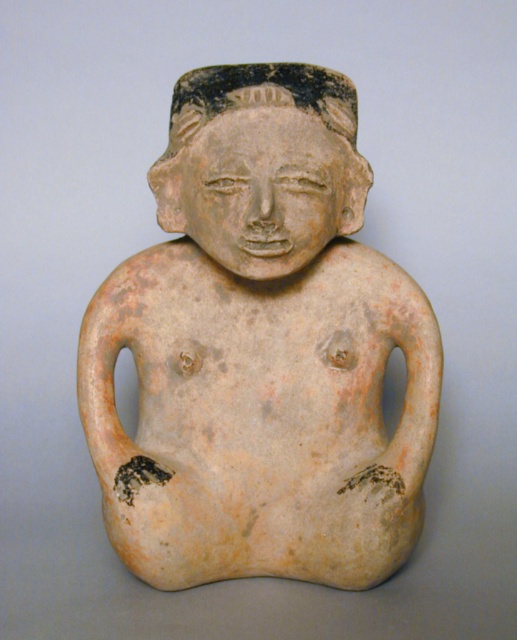
Question: Which object is closer to the camera taking this photo?

Choices:
 (A) matte clay figure at center
 (B) matte clay head at center

Answer: (B)

Question: Is matte clay figure at center smaller than matte clay head at center?

Choices:
 (A) no
 (B) yes

Answer: (A)

Question: Does matte clay figure at center have a smaller size compared to matte clay head at center?

Choices:
 (A) no
 (B) yes

Answer: (A)

Question: In this image, where is matte clay figure at center located relative to matte clay head at center?

Choices:
 (A) left
 (B) right

Answer: (A)

Question: Among these objects, which one is farthest from the camera?

Choices:
 (A) matte clay figure at center
 (B) matte clay head at center

Answer: (A)

Question: Which of the following is the closest to the observer?

Choices:
 (A) matte clay head at center
 (B) matte clay figure at center

Answer: (A)